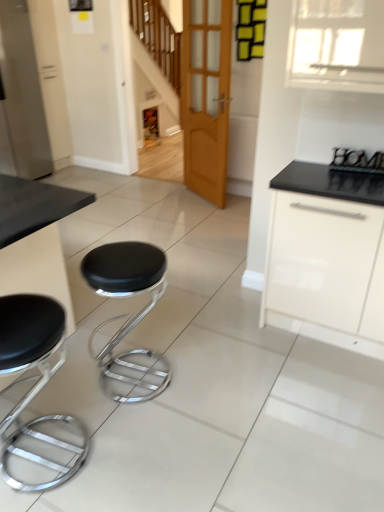
Question: Does black leather stool at lower left, the 1th stool positioned from the left, appear on the left side of white glossy cabinet at right?

Choices:
 (A) no
 (B) yes

Answer: (B)

Question: Considering the relative positions of black leather stool at lower left, the 2th stool from the right, and white glossy cabinet at right in the image provided, is black leather stool at lower left, the 2th stool from the right, to the right of white glossy cabinet at right from the viewer's perspective?

Choices:
 (A) no
 (B) yes

Answer: (A)

Question: Is black leather stool at lower left, the 2th stool from the right, not within white glossy cabinet at right?

Choices:
 (A) yes
 (B) no

Answer: (A)

Question: Is black leather stool at lower left, the 1th stool positioned from the left, aimed at white glossy cabinet at right?

Choices:
 (A) yes
 (B) no

Answer: (B)

Question: Is the depth of black leather stool at lower left, the 1th stool positioned from the left, less than that of white glossy cabinet at right?

Choices:
 (A) yes
 (B) no

Answer: (A)

Question: From the image's perspective, is black leather stool at lower left, the 1th stool positioned from the left, positioned above or below white glossy cabinet at right?

Choices:
 (A) above
 (B) below

Answer: (B)

Question: Considering the positions of black leather stool at lower left, the 2th stool from the right, and white glossy cabinet at right in the image, is black leather stool at lower left, the 2th stool from the right, bigger or smaller than white glossy cabinet at right?

Choices:
 (A) big
 (B) small

Answer: (B)

Question: From a real-world perspective, relative to white glossy cabinet at right, is black leather stool at lower left, the 1th stool positioned from the left, vertically above or below?

Choices:
 (A) below
 (B) above

Answer: (A)

Question: In terms of height, does black leather stool at lower left, the 2th stool from the right, look taller or shorter compared to white glossy cabinet at right?

Choices:
 (A) short
 (B) tall

Answer: (A)

Question: Is white glossy cabinet at right in front of or behind satin white refrigerator at left, placed as the 2th appliance when sorted from bottom to top, in the image?

Choices:
 (A) behind
 (B) front

Answer: (B)

Question: From a real-world perspective, is white glossy cabinet at right physically located above or below satin white refrigerator at left, which is counted as the first appliance, starting from the left?

Choices:
 (A) above
 (B) below

Answer: (B)

Question: In terms of height, does white glossy cabinet at right look taller or shorter compared to satin white refrigerator at left, placed as the 2th appliance when sorted from bottom to top?

Choices:
 (A) short
 (B) tall

Answer: (A)

Question: From the image's perspective, is white glossy cabinet at right positioned above or below satin white refrigerator at left, which is the 1th appliance in top-to-bottom order?

Choices:
 (A) below
 (B) above

Answer: (A)

Question: Is metallic black sign at upper right, acting as the first appliance starting from the right, taller or shorter than black leather stool at center, which is the second stool from left to right?

Choices:
 (A) short
 (B) tall

Answer: (A)

Question: Is metallic black sign at upper right, acting as the first appliance starting from the right, spatially inside black leather stool at center, which is the second stool from left to right, or outside of it?

Choices:
 (A) outside
 (B) inside

Answer: (A)